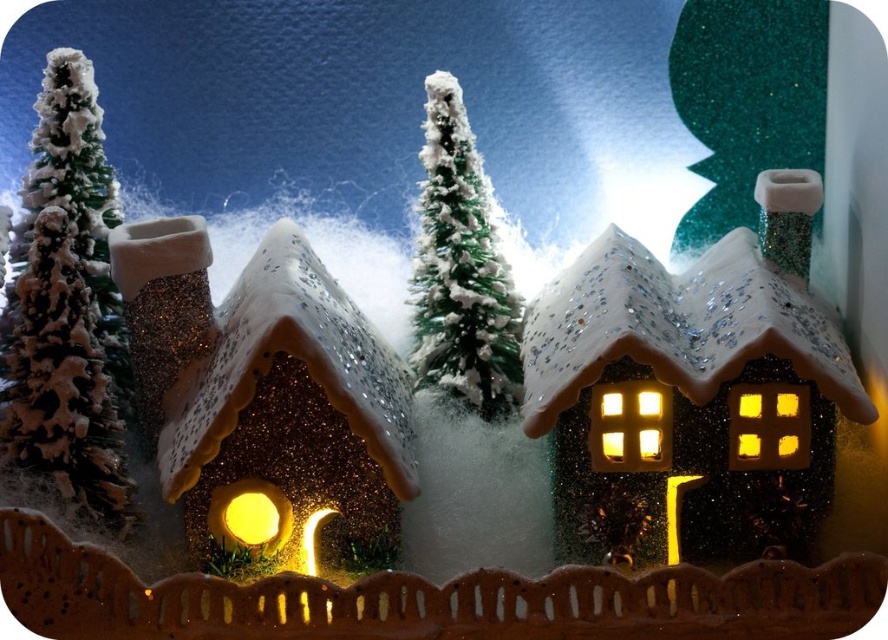
Question: Is green glittery tree at left thinner than green frosted tree at center?

Choices:
 (A) yes
 (B) no

Answer: (B)

Question: Which object is farther from the camera taking this photo?

Choices:
 (A) green frosted tree at center
 (B) green glittery tree at left

Answer: (A)

Question: Does green glittery tree at left appear on the right side of green frosted tree at center?

Choices:
 (A) no
 (B) yes

Answer: (A)

Question: Which point is farther from the camera taking this photo?

Choices:
 (A) [x=438, y=209]
 (B) [x=37, y=172]

Answer: (A)

Question: Can you confirm if green glittery tree at left is thinner than green frosted tree at center?

Choices:
 (A) no
 (B) yes

Answer: (A)